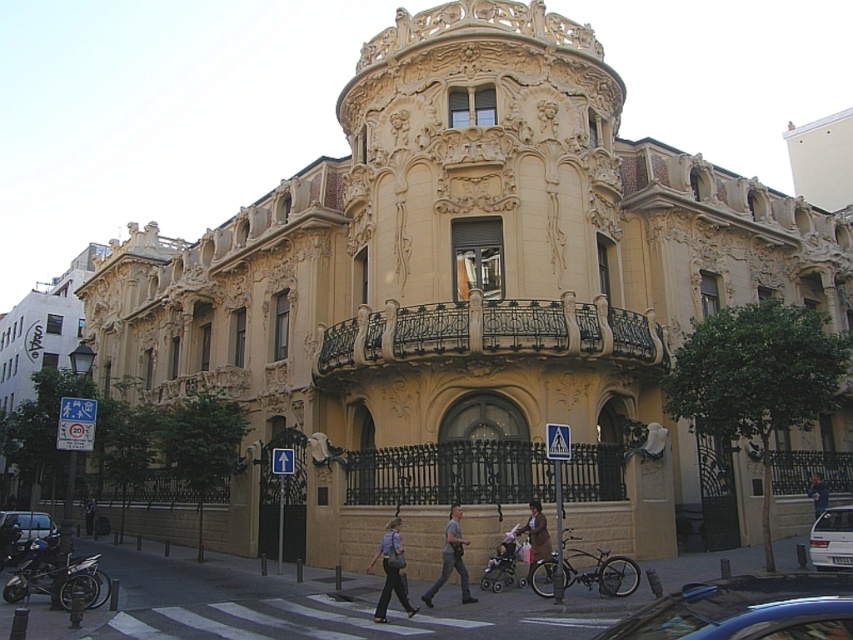
In the scene shown: You are standing in front of the grand ornate building and see the point marked as point (22, 531). Is this point located on the balcony or on the upper levels?

The point (22, 531) is located on the balcony because the balcony is at a lower level than the upper levels of the building.

You are standing at the entrance of the grand, ornate building. You see a metallic silver car at lower left and gray fabric pants at center. Which object is closer to you?

The metallic silver car at lower left is closer to you because it is only 37.02 meters away from the gray fabric pants at center, but since distance is measured from the observer, the car being at lower left would typically be positioned closer in such compositions.